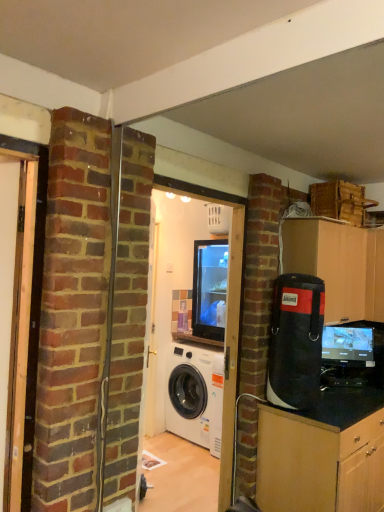
Measure the distance between point [2,279] and camera.

5.58 feet.

You are a GUI agent. You are given a task and a screenshot of the screen. Output one action in this format:
    pyautogui.click(x=<x>, y=<y>)
    Task: Click on the wooden door at left
    This screenshot has width=384, height=512.
    Given the screenshot: What is the action you would take?
    pyautogui.click(x=6, y=286)

Describe the element at coordinates (6, 286) in the screenshot. The image size is (384, 512). I see `wooden door at left` at that location.

Where is `wooden door at left`? The image size is (384, 512). wooden door at left is located at coordinates (6, 286).